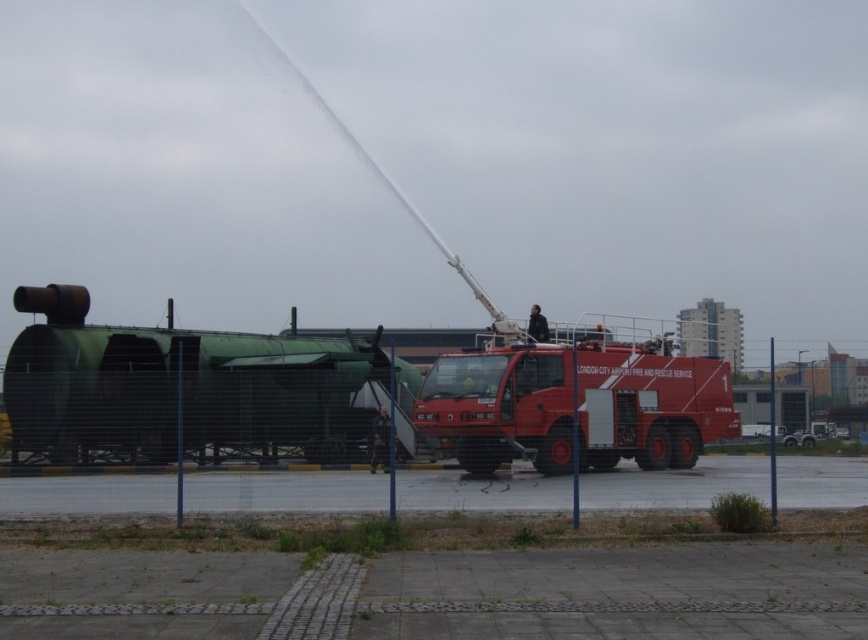
You are a firefighter trying to reach a person trapped on the roof of a building. The green matte tank at left and the matte red fire truck at center are blocking your path. Which object should you move first to clear the path?

You should move the green matte tank at left first because it is in front of the matte red fire truck at center, so removing it would allow access to the fire truck and create a clearer path.

You are a maintenance worker who needs to park a new vehicle between the green matte tank at left and the matte red fire truck at center. Based on their widths, can you safely fit the new vehicle between them?

The green matte tank at left might be wider than the matte red fire truck at center, so there might not be enough space between them to safely park the new vehicle.

Based on the photo, you are a firefighter who needs to move from the green matte tank at left to the matte red fire truck at center during an emergency. Can you walk directly between them without any obstacles?

The distance between the green matte tank at left and the matte red fire truck at center is 4.86 meters, so yes, you can walk directly between them without any obstacles since there is enough space.